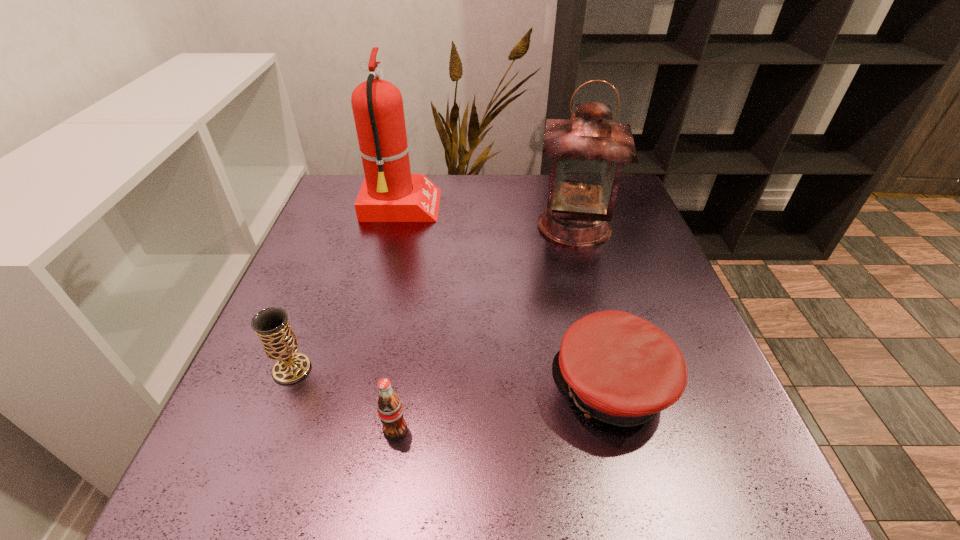
At what (x,y) coordinates should I click in order to perform the action: click on vacant region at the far edge of the desktop. Please return your answer as a coordinate pair (x, y). Looking at the image, I should click on point(484,212).

The height and width of the screenshot is (540, 960). In order to click on vacant space at the near edge of the desktop in this screenshot , I will do `click(617, 508)`.

At what (x,y) coordinates should I click in order to perform the action: click on blank space at the left edge of the desktop. Please return your answer as a coordinate pair (x, y). This screenshot has width=960, height=540. Looking at the image, I should click on (294, 447).

Where is `free space at the right edge of the desktop`? Image resolution: width=960 pixels, height=540 pixels. free space at the right edge of the desktop is located at coordinates (667, 325).

Where is `vacant area at the far right corner`? This screenshot has width=960, height=540. vacant area at the far right corner is located at coordinates (626, 181).

In the image, there is a desktop. Where is `vacant region at the near right corner`? Image resolution: width=960 pixels, height=540 pixels. vacant region at the near right corner is located at coordinates (694, 517).

Find the location of `free point between the fire extinguisher and the chalice`. free point between the fire extinguisher and the chalice is located at coordinates (347, 288).

The width and height of the screenshot is (960, 540). I want to click on free area in between the cap and the fire extinguisher, so click(506, 298).

I want to click on free spot between the chalice and the soda, so click(x=344, y=400).

This screenshot has height=540, width=960. Identify the location of free space between the soda and the oil lamp. (485, 328).